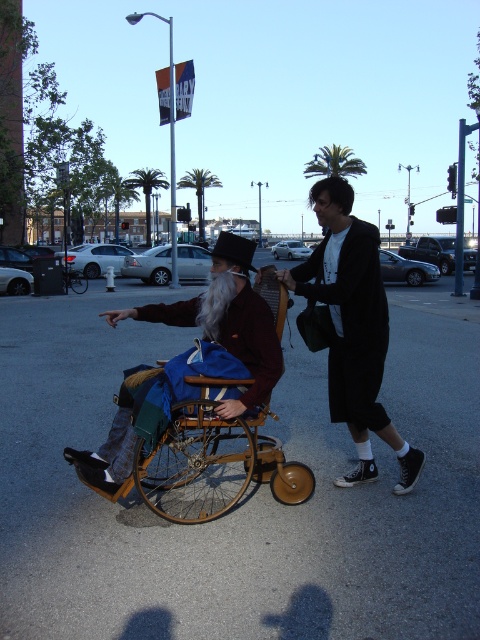
Question: Is black leather jacket at center below wooden wheelchair at center?

Choices:
 (A) yes
 (B) no

Answer: (B)

Question: Among these objects, which one is farthest from the camera?

Choices:
 (A) wooden wheelchair at center
 (B) black leather jacket at center

Answer: (B)

Question: Can you confirm if black leather jacket at center is thinner than wooden wheelchair at center?

Choices:
 (A) yes
 (B) no

Answer: (A)

Question: Can you confirm if black leather jacket at center is positioned to the right of wooden wheelchair at center?

Choices:
 (A) no
 (B) yes

Answer: (B)

Question: Among these points, which one is farthest from the camera?

Choices:
 (A) (182, 454)
 (B) (374, 342)

Answer: (A)

Question: Which of the following is the farthest from the observer?

Choices:
 (A) (144, 468)
 (B) (330, 268)

Answer: (B)